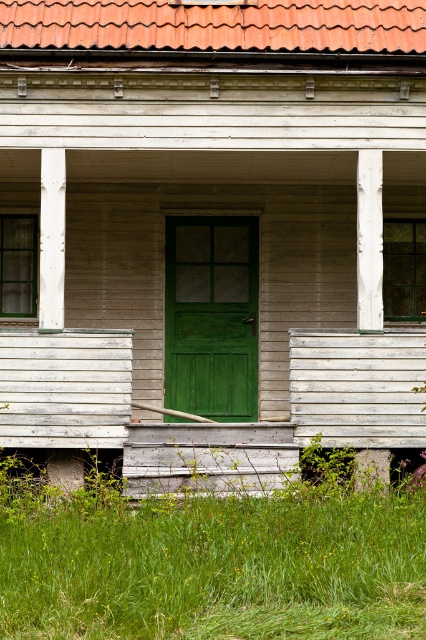
I want to click on green wood door at center, so click(210, 259).

Is green wood door at center closer to camera compared to white painted wood post at center?

No.

The height and width of the screenshot is (640, 426). What do you see at coordinates (210, 259) in the screenshot?
I see `green wood door at center` at bounding box center [210, 259].

Where is `green wood door at center`? green wood door at center is located at coordinates (210, 259).

Does point (302, 532) lie behind point (365, 474)?

No, (302, 532) is closer to viewer.

Does green grass at lower center lie behind smooth white wooden post at lower right?

No, green grass at lower center is in front of smooth white wooden post at lower right.

At what (x,y) coordinates should I click in order to perform the action: click on green grass at lower center. Please return your answer as a coordinate pair (x, y). Looking at the image, I should click on (209, 563).

The width and height of the screenshot is (426, 640). In order to click on green grass at lower center in this screenshot , I will do `click(209, 563)`.

Is green grass at lower center below white wood column at left?

Yes.

Between point (81, 529) and point (57, 250), which one is positioned behind?

Positioned behind is point (57, 250).

What do you see at coordinates (209, 563) in the screenshot? This screenshot has width=426, height=640. I see `green grass at lower center` at bounding box center [209, 563].

The height and width of the screenshot is (640, 426). Identify the location of green grass at lower center. (209, 563).